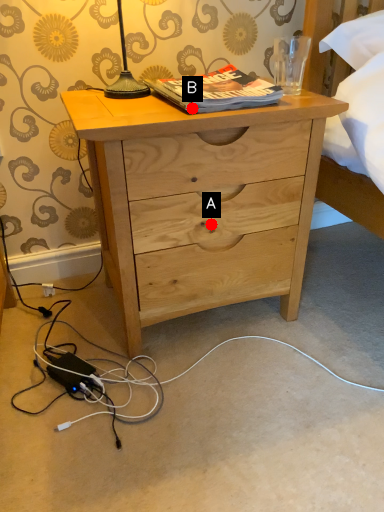
Question: Two points are circled on the image, labeled by A and B beside each circle. Among these points, which one is farthest from the camera?

Choices:
 (A) A is further
 (B) B is further

Answer: (A)